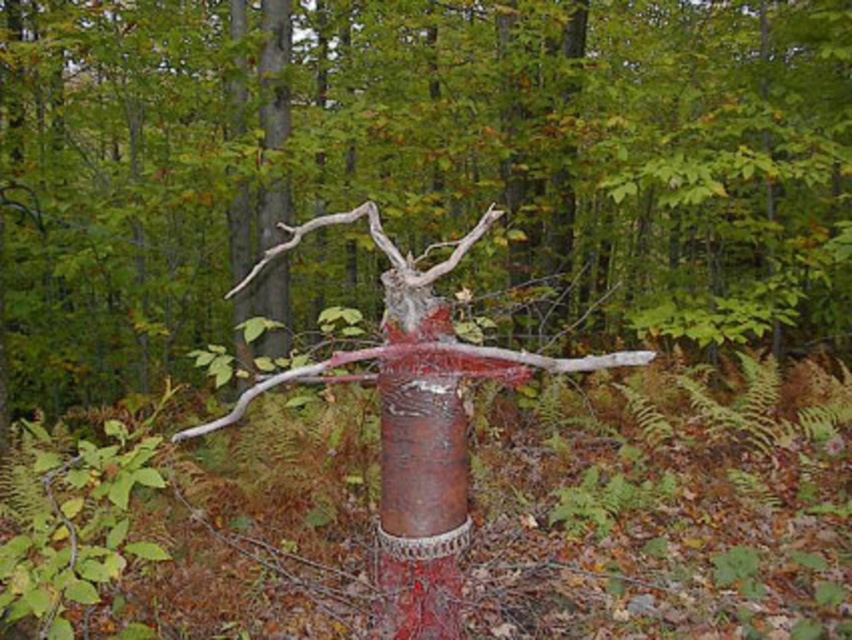
Question: Can you confirm if rusty metal tree at center is positioned to the left of rusty metal pole at center?

Choices:
 (A) no
 (B) yes

Answer: (A)

Question: Is rusty metal tree at center further to the viewer compared to rusty metal branch at center?

Choices:
 (A) yes
 (B) no

Answer: (A)

Question: Which of the following is the closest to the observer?

Choices:
 (A) rusty metal pole at center
 (B) rusty metal tree at center

Answer: (A)

Question: Does rusty metal tree at center have a smaller size compared to rusty metal pole at center?

Choices:
 (A) yes
 (B) no

Answer: (A)

Question: Which object is the closest to the rusty metal tree at center?

Choices:
 (A) rusty metal branch at center
 (B) rusty metal pole at center

Answer: (A)

Question: Based on their relative distances, which object is nearer to the rusty metal branch at center?

Choices:
 (A) rusty metal tree at center
 (B) rusty metal pole at center

Answer: (B)